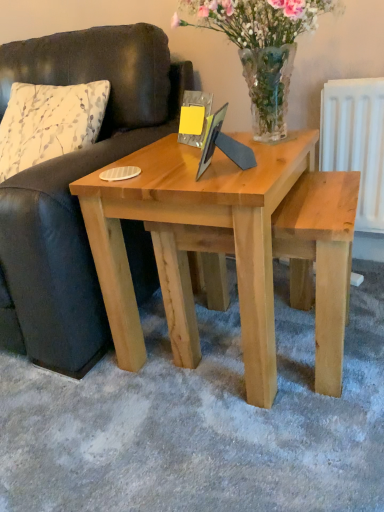
Question: Looking at their shapes, would you say leather couch at left is wider or thinner than natural wood coffee table at center?

Choices:
 (A) wide
 (B) thin

Answer: (A)

Question: In terms of size, does leather couch at left appear bigger or smaller than natural wood coffee table at center?

Choices:
 (A) small
 (B) big

Answer: (B)

Question: Estimate the real-world distances between objects in this image. Which object is farther from the white printed fabric pillow at left?

Choices:
 (A) leather couch at left
 (B) clear glass vase at center
 (C) natural wood coffee table at center

Answer: (B)

Question: Which object is positioned closest to the leather couch at left?

Choices:
 (A) white printed fabric pillow at left
 (B) natural wood coffee table at center
 (C) clear glass vase at center

Answer: (A)